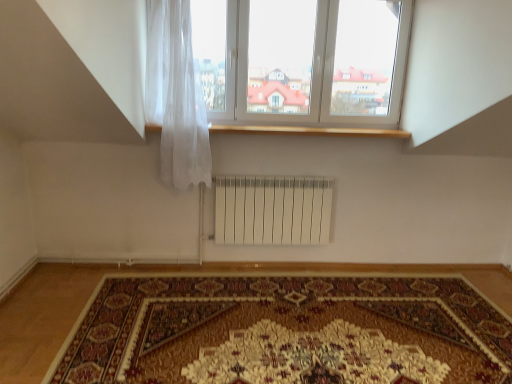
Question: Can you confirm if translucent white curtain at upper left is positioned to the right of carpeted rug at center?

Choices:
 (A) no
 (B) yes

Answer: (A)

Question: Is translucent white curtain at upper left positioned beyond the bounds of carpeted rug at center?

Choices:
 (A) yes
 (B) no

Answer: (A)

Question: Could you tell me if translucent white curtain at upper left is facing carpeted rug at center?

Choices:
 (A) no
 (B) yes

Answer: (A)

Question: From the image's perspective, is translucent white curtain at upper left above carpeted rug at center?

Choices:
 (A) yes
 (B) no

Answer: (A)

Question: Is translucent white curtain at upper left at the left side of carpeted rug at center?

Choices:
 (A) no
 (B) yes

Answer: (B)

Question: Considering the positions of carpeted rug at center and wooden at upper center in the image, is carpeted rug at center wider or thinner than wooden at upper center?

Choices:
 (A) thin
 (B) wide

Answer: (B)

Question: Is carpeted rug at center bigger or smaller than wooden at upper center?

Choices:
 (A) small
 (B) big

Answer: (B)

Question: Is carpeted rug at center situated inside wooden at upper center or outside?

Choices:
 (A) inside
 (B) outside

Answer: (B)

Question: From a real-world perspective, is carpeted rug at center above or below wooden at upper center?

Choices:
 (A) above
 (B) below

Answer: (B)

Question: In the image, is carpeted rug at center positioned in front of or behind white plastic window at upper center?

Choices:
 (A) behind
 (B) front

Answer: (B)

Question: In terms of width, does carpeted rug at center look wider or thinner when compared to white plastic window at upper center?

Choices:
 (A) wide
 (B) thin

Answer: (A)

Question: Visually, is carpeted rug at center positioned to the left or to the right of white plastic window at upper center?

Choices:
 (A) right
 (B) left

Answer: (B)

Question: From a real-world perspective, is carpeted rug at center above or below white plastic window at upper center?

Choices:
 (A) below
 (B) above

Answer: (A)

Question: Is white plastic window at upper center in front of or behind translucent white curtain at upper left in the image?

Choices:
 (A) behind
 (B) front

Answer: (A)

Question: From a real-world perspective, is white plastic window at upper center physically located above or below translucent white curtain at upper left?

Choices:
 (A) below
 (B) above

Answer: (B)